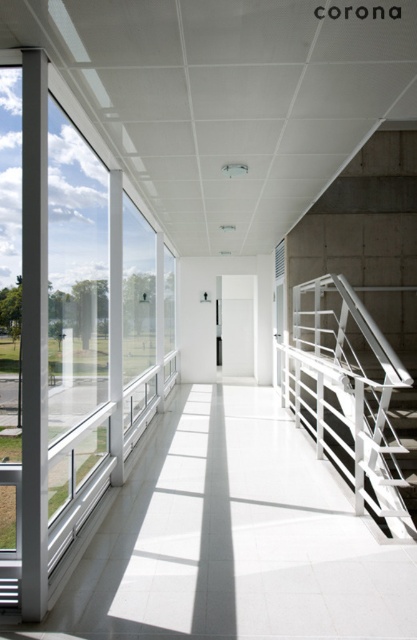
Question: Can you confirm if transparent glass window at left is bigger than white metal railing at right?

Choices:
 (A) no
 (B) yes

Answer: (B)

Question: Which point appears closest to the camera in this image?

Choices:
 (A) (42, 563)
 (B) (412, 531)

Answer: (A)

Question: Can you confirm if transparent glass window at left is positioned to the right of white metal railing at right?

Choices:
 (A) no
 (B) yes

Answer: (A)

Question: Is transparent glass window at left bigger than white metal railing at right?

Choices:
 (A) yes
 (B) no

Answer: (A)

Question: Which point is closer to the camera taking this photo?

Choices:
 (A) (361, 438)
 (B) (77, 237)

Answer: (A)